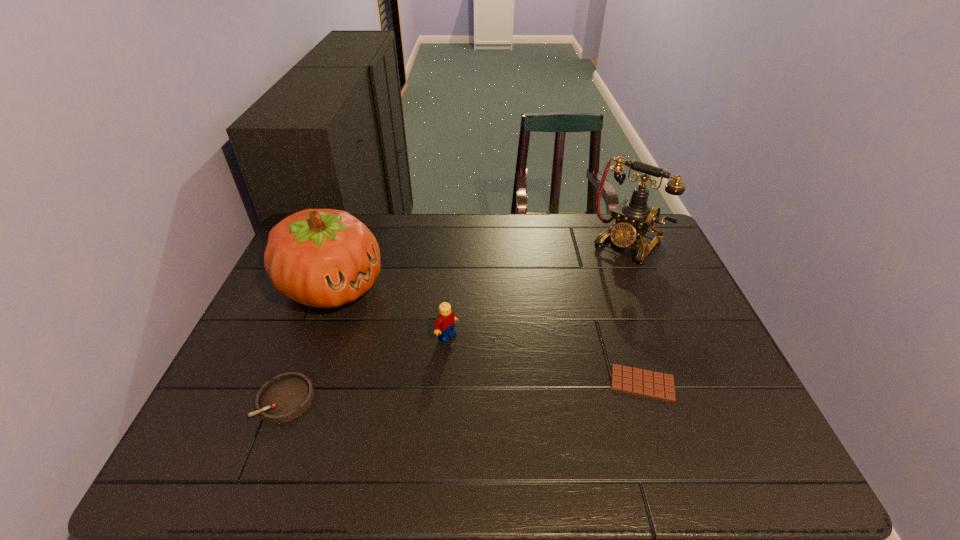
Identify the location of vacant space located on the side of the pumpkin with the cute face. (470, 363).

Find the location of a particular element. The width and height of the screenshot is (960, 540). vacant region located on the front-facing side of the third nearest object is located at coordinates (551, 414).

Identify the location of vacant point located 0.330m on the front-facing side of the third nearest object. (563, 423).

The image size is (960, 540). I want to click on vacant space located 0.140m on the front-facing side of the third nearest object, so click(496, 374).

I want to click on vacant space located on the front of the telephone, featuring the rotary dial, so (586, 291).

Locate an element on the screen. Image resolution: width=960 pixels, height=540 pixels. free space located on the front of the telephone, featuring the rotary dial is located at coordinates (542, 339).

Where is `vacant region located 0.070m on the front of the telephone, featuring the rotary dial`? The image size is (960, 540). vacant region located 0.070m on the front of the telephone, featuring the rotary dial is located at coordinates 601,273.

In order to click on pumpkin that is at the far edge in this screenshot , I will do `click(325, 258)`.

Locate an element on the screen. Image resolution: width=960 pixels, height=540 pixels. telephone located in the far edge section of the desktop is located at coordinates (634, 218).

Find the location of a particular element. This screenshot has height=540, width=960. ashtray positioned at the near edge is located at coordinates (287, 396).